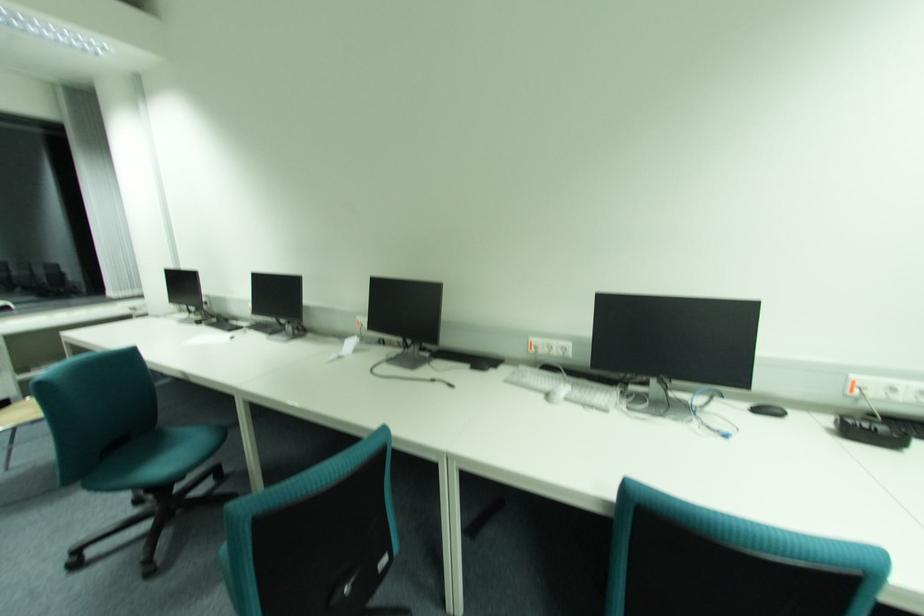
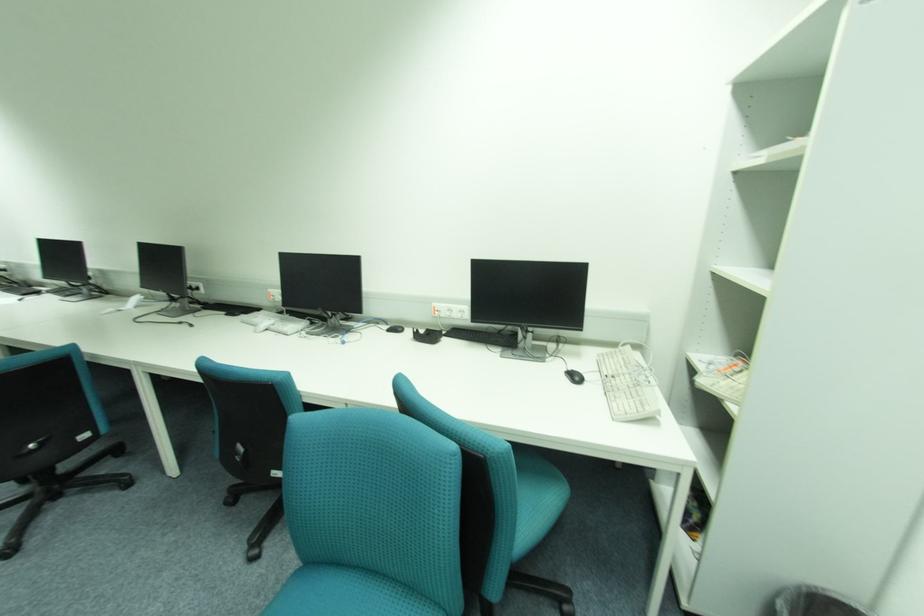
Where in the second image is the point corresponding to [861,378] from the first image?

(441, 305)